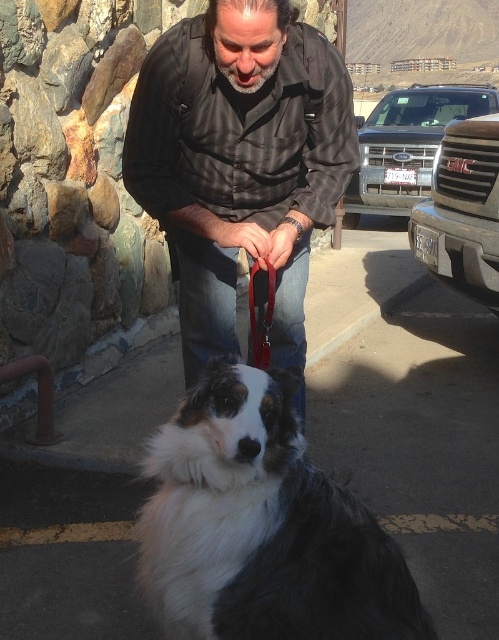
Question: Can you confirm if matte black shirt at center is positioned to the right of white fluffy dog at center?

Choices:
 (A) no
 (B) yes

Answer: (A)

Question: Based on their relative distances, which object is nearer to the matte black shirt at center?

Choices:
 (A) red leather leash at center
 (B) metallic silver grille at right
 (C) white fluffy dog at center

Answer: (A)

Question: Which of these objects is positioned farthest from the metallic silver grille at right?

Choices:
 (A) white fluffy dog at center
 (B) matte black shirt at center

Answer: (A)

Question: Which object is farther from the camera taking this photo?

Choices:
 (A) metallic silver grille at right
 (B) white fluffy dog at center

Answer: (A)

Question: Is matte black shirt at center below white fluffy dog at center?

Choices:
 (A) yes
 (B) no

Answer: (B)

Question: Can you confirm if matte black shirt at center is positioned to the left of red leather leash at center?

Choices:
 (A) no
 (B) yes

Answer: (B)